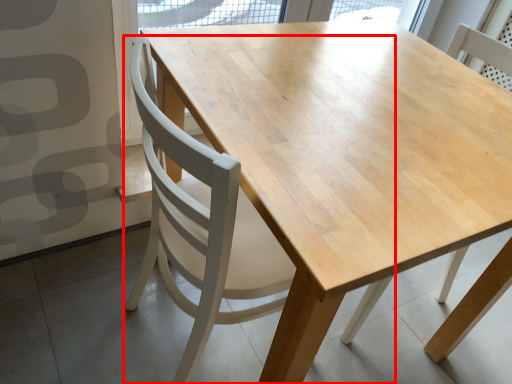
Question: In this image, where is chair (annotated by the red box) located relative to chair?

Choices:
 (A) right
 (B) left

Answer: (B)